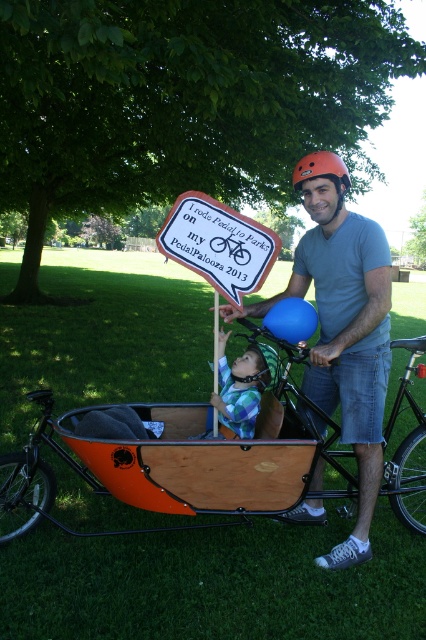
Question: Which is farther from the checkered fabric baby at center?

Choices:
 (A) orange matte helmet at upper center
 (B) matte gray helmet at upper center

Answer: (A)

Question: Observing the image, what is the correct spatial positioning of matte gray helmet at upper center in reference to orange matte helmet at upper center?

Choices:
 (A) right
 (B) left

Answer: (B)

Question: From the image, what is the correct spatial relationship of checkered fabric baby at center in relation to orange matte helmet at upper center?

Choices:
 (A) left
 (B) right

Answer: (A)

Question: Which point is farther to the camera?

Choices:
 (A) checkered fabric baby at center
 (B) matte gray helmet at upper center
 (C) orange matte helmet at upper center

Answer: (A)

Question: Does matte gray helmet at upper center have a greater width compared to orange matte helmet at upper center?

Choices:
 (A) yes
 (B) no

Answer: (A)

Question: Which object appears closest to the camera in this image?

Choices:
 (A) orange matte helmet at upper center
 (B) matte gray helmet at upper center

Answer: (B)